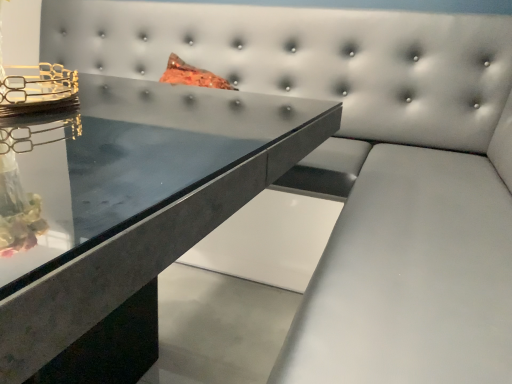
Where is `black glass table at center`? black glass table at center is located at coordinates (125, 212).

Image resolution: width=512 pixels, height=384 pixels. What do you see at coordinates (125, 212) in the screenshot?
I see `black glass table at center` at bounding box center [125, 212].

Locate an element on the screen. Image resolution: width=512 pixels, height=384 pixels. black glass table at center is located at coordinates (125, 212).